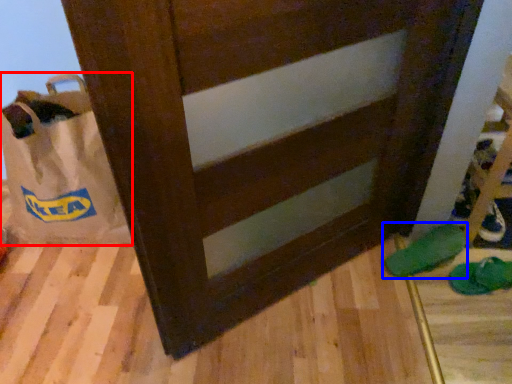
Question: Which point is further to the camera, grocery bag (highlighted by a red box) or footwear (highlighted by a blue box)?

Choices:
 (A) grocery bag
 (B) footwear

Answer: (B)